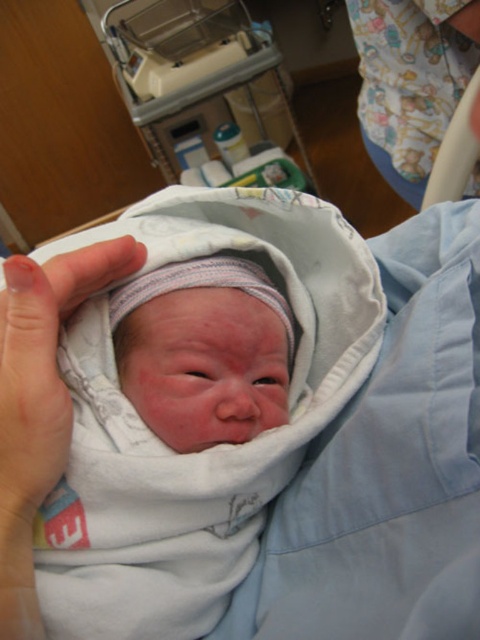
You are a healthcare worker standing near the hospital bed and want to reach the point marked at coordinates point (156, 282). Can you estimate how far you need to reach to touch that point?

The distance between point (156, 282) and the viewer is 38.61 centimeters, so you need to reach approximately 38.61 centimeters to touch that point.

You are a nurse in a hospital room. You need to check the baby in the light blue blanket. Which object is closer to the top of the image, the smooth white swaddle at center or the pink flesh at center?

The smooth white swaddle at center is located above the pink flesh at center, so the smooth white swaddle at center is closer to the top of the image.